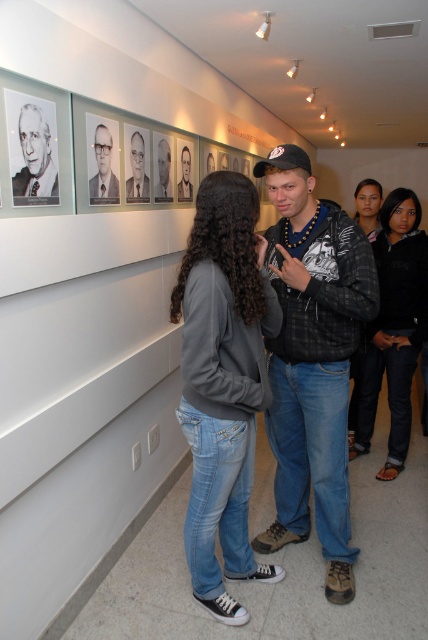
You are an art student standing in the gallery and notice two jackets hanging on a rack near the entrance. The black leather jacket at center and the smooth black jacket at center are both on the rack. Which jacket is closer to you?

The black leather jacket at center is closer to you because it is in front of the smooth black jacket at center.

You are standing in the art gallery and want to touch the black leather jacket at center without moving your feet. Is it possible to reach it?

The black leather jacket at center and viewer are 1.80 meters apart from each other, so you cannot reach it without moving since the distance is too far.